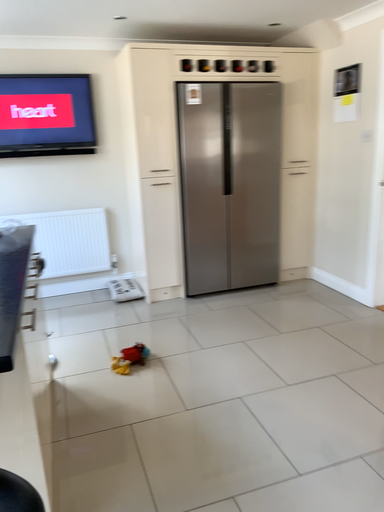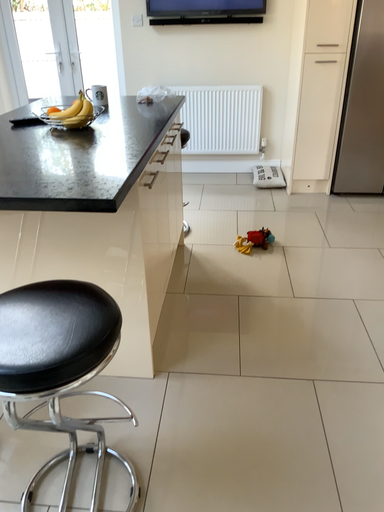
Question: How did the camera likely rotate when shooting the video?

Choices:
 (A) rotated right
 (B) rotated left

Answer: (B)